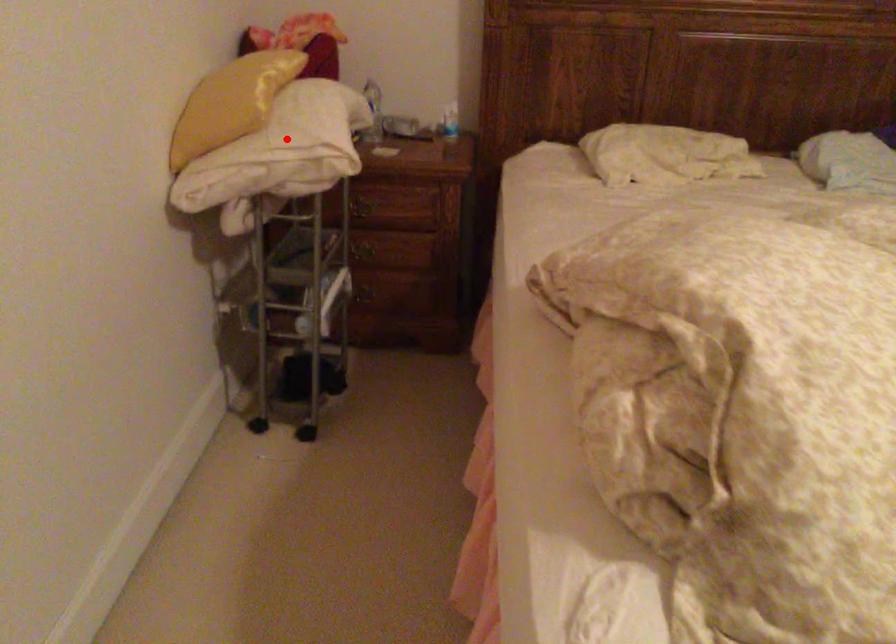
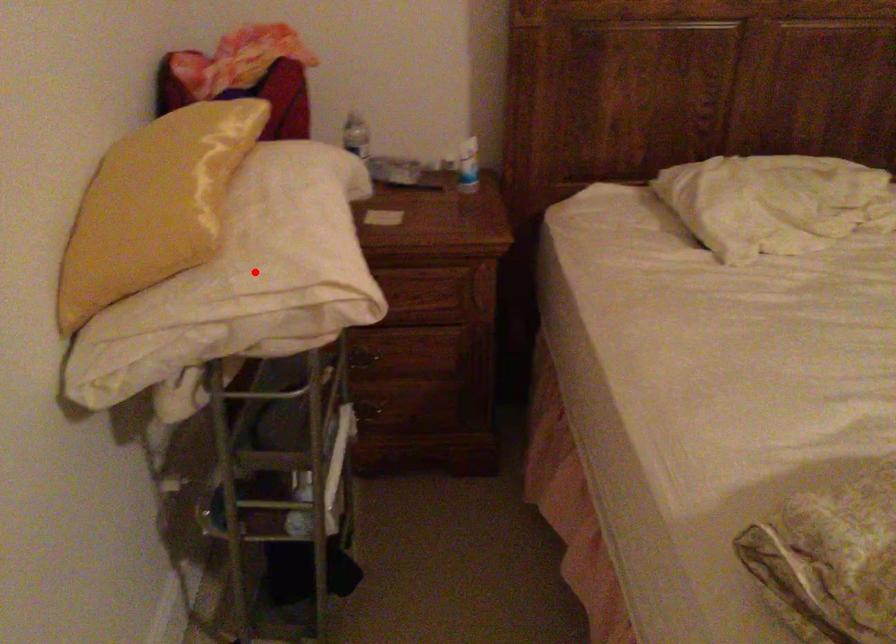
I am providing you with two images of the same scene from different viewpoints. A red point is marked on the first image and another point is marked on the second image. Is the red point in image1 aligned with the point shown in image2?

Yes